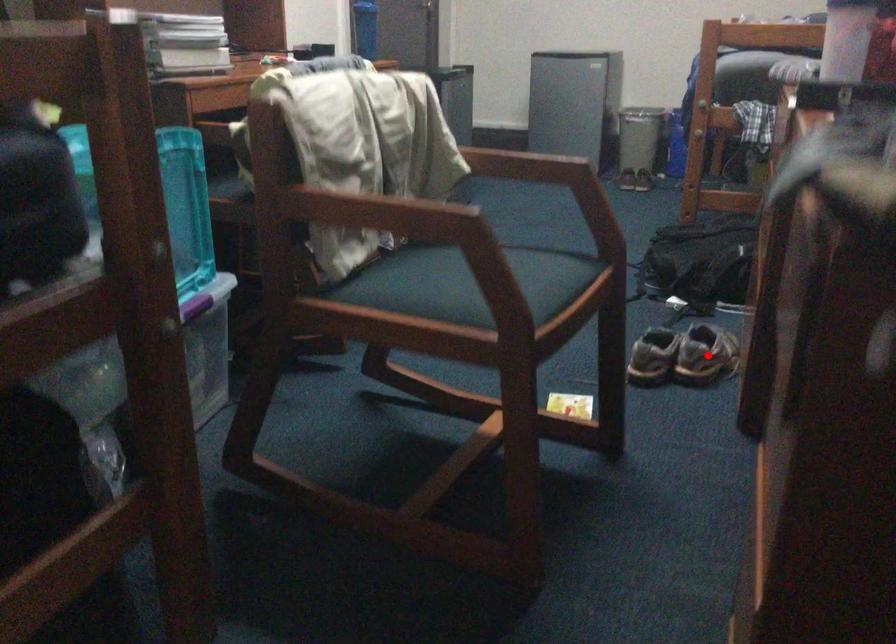
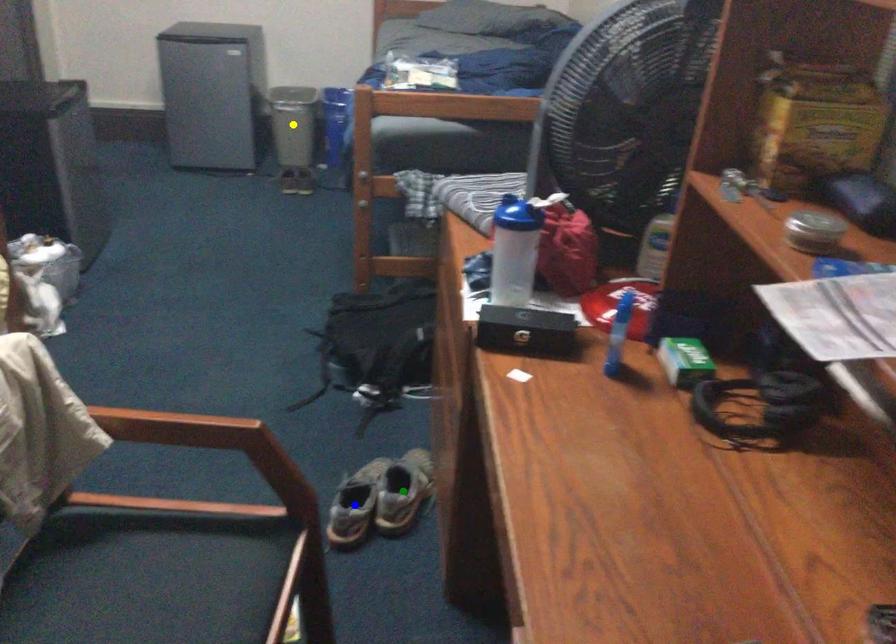
Question: I am providing you with two images of the same scene from different viewpoints. A red point is marked on the first image. You are given multiple points on the second image. Can you choose the point in image 2 that corresponds to the point in image 1?

Choices:
 (A) green point
 (B) blue point
 (C) yellow point

Answer: (A)